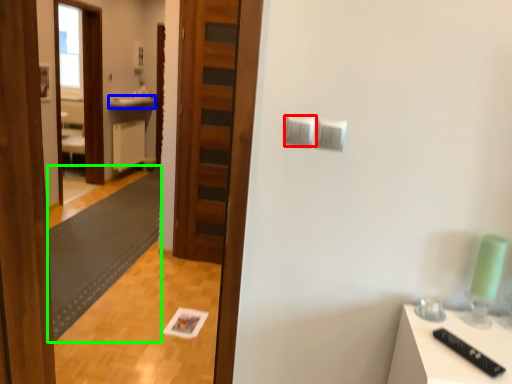
Question: Considering the real-world distances, which object is farthest from light switch (highlighted by a red box)? counter top (highlighted by a blue box) or mat (highlighted by a green box)?

Choices:
 (A) counter top
 (B) mat

Answer: (A)